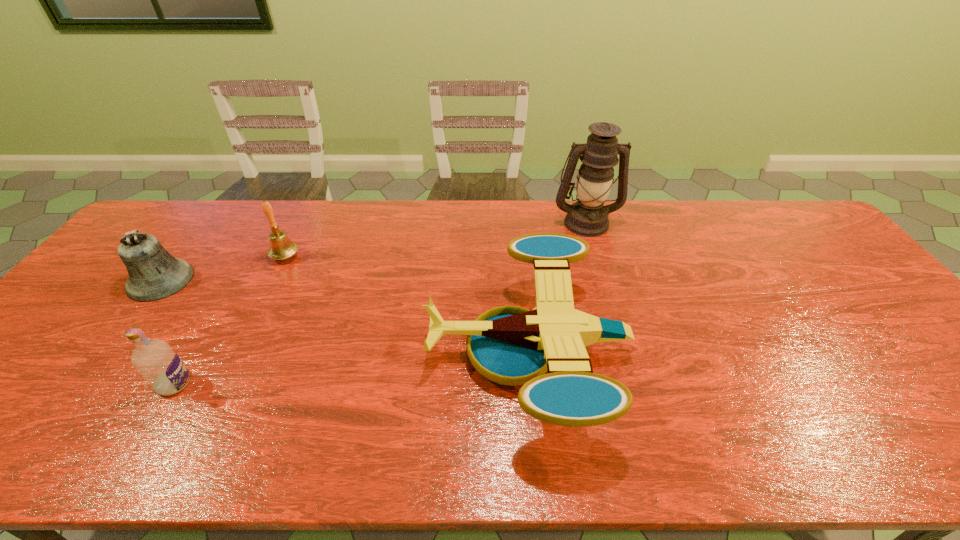
Locate an element on the screen. The width and height of the screenshot is (960, 540). free location at the right edge of the desktop is located at coordinates (786, 253).

Where is `free space at the far left corner of the desktop`? free space at the far left corner of the desktop is located at coordinates (156, 215).

At what (x,y) coordinates should I click in order to perform the action: click on vacant area between the drone and the second object from left to right. Please return your answer as a coordinate pair (x, y). Looking at the image, I should click on (350, 367).

The height and width of the screenshot is (540, 960). Find the location of `free spot between the third object from right to left and the left bell`. free spot between the third object from right to left and the left bell is located at coordinates (223, 268).

At what (x,y) coordinates should I click in order to perform the action: click on free space between the drone and the vodka. Please return your answer as a coordinate pair (x, y). The image size is (960, 540). Looking at the image, I should click on (350, 367).

Find the location of `free point between the drone and the left bell`. free point between the drone and the left bell is located at coordinates (344, 316).

I want to click on vacant area between the right bell and the farthest object, so click(x=436, y=239).

Where is `vacant point located between the third object from left to right and the leftmost object`? vacant point located between the third object from left to right and the leftmost object is located at coordinates (223, 268).

The height and width of the screenshot is (540, 960). I want to click on empty space that is in between the vodka and the shorter bell, so click(x=168, y=332).

Find the location of `free space between the right bell and the second object from left to right`. free space between the right bell and the second object from left to right is located at coordinates pos(229,320).